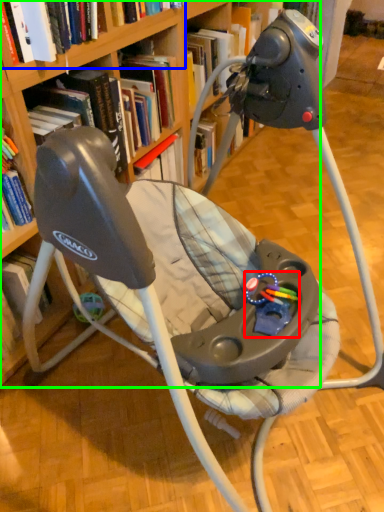
Question: Which is nearer to the toy (highlighted by a red box)? book (highlighted by a blue box) or bookcase (highlighted by a green box).

Choices:
 (A) book
 (B) bookcase

Answer: (B)